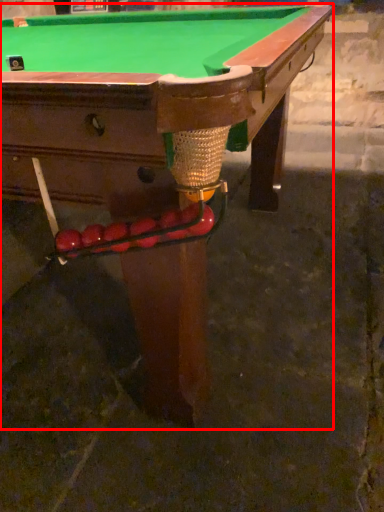
Question: From the image, what is the correct spatial relationship of billiard table (annotated by the red box) in relation to fruit?

Choices:
 (A) left
 (B) right

Answer: (A)